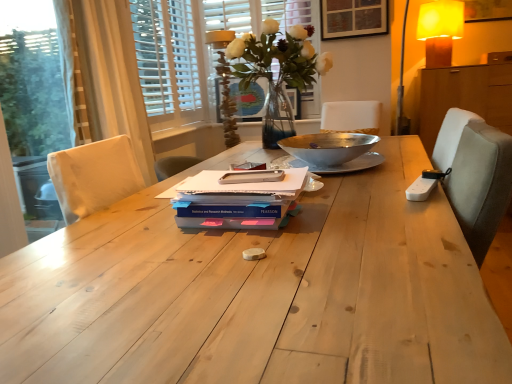
Question: Which direction should I rotate to look at clear glass vase at upper center, placed as the 2th bay window when sorted from left to right, — up or down?

Choices:
 (A) down
 (B) up

Answer: (B)

Question: Is blue matte paperback book at center, the third paperback book viewed from the top, inside clear glass vase at upper center, the 1th bay window viewed from the right?

Choices:
 (A) no
 (B) yes

Answer: (A)

Question: Considering the relative sizes of clear glass vase at upper center, the 1th bay window viewed from the right, and blue matte paperback book at center, the third paperback book viewed from the top, in the image provided, is clear glass vase at upper center, the 1th bay window viewed from the right, bigger than blue matte paperback book at center, the third paperback book viewed from the top,?

Choices:
 (A) yes
 (B) no

Answer: (A)

Question: Is clear glass vase at upper center, placed as the 2th bay window when sorted from left to right, looking in the opposite direction of blue matte paperback book at center, the third paperback book viewed from the top?

Choices:
 (A) yes
 (B) no

Answer: (B)

Question: Is clear glass vase at upper center, the 1th bay window viewed from the right, located outside blue matte paperback book at center, which appears as the first paperback book when ordered from the bottom?

Choices:
 (A) no
 (B) yes

Answer: (B)

Question: Does clear glass vase at upper center, the 1th bay window viewed from the right, appear on the right side of blue matte paperback book at center, which appears as the first paperback book when ordered from the bottom?

Choices:
 (A) yes
 (B) no

Answer: (A)

Question: Does clear glass vase at upper center, the 1th bay window viewed from the right, have a smaller size compared to blue matte paperback book at center, the third paperback book viewed from the top?

Choices:
 (A) yes
 (B) no

Answer: (B)

Question: From the image's perspective, would you say matte glass vase at upper center, arranged as the 2th table lamp when viewed from the right, is shown under translucent glass vase at center?

Choices:
 (A) no
 (B) yes

Answer: (A)

Question: From a real-world perspective, is matte glass vase at upper center, positioned as the 1th table lamp in bottom-to-top order, positioned under translucent glass vase at center based on gravity?

Choices:
 (A) yes
 (B) no

Answer: (A)

Question: Considering the relative sizes of matte glass vase at upper center, arranged as the 2th table lamp when viewed from the right, and translucent glass vase at center in the image provided, is matte glass vase at upper center, arranged as the 2th table lamp when viewed from the right, smaller than translucent glass vase at center?

Choices:
 (A) no
 (B) yes

Answer: (B)

Question: Does matte glass vase at upper center, arranged as the first table lamp when viewed from the left, have a greater height compared to translucent glass vase at center?

Choices:
 (A) yes
 (B) no

Answer: (A)

Question: Does matte glass vase at upper center, arranged as the first table lamp when viewed from the left, appear on the right side of translucent glass vase at center?

Choices:
 (A) no
 (B) yes

Answer: (A)

Question: Does matte glass vase at upper center, the first table lamp from the front, come in front of translucent glass vase at center?

Choices:
 (A) no
 (B) yes

Answer: (A)

Question: From a real-world perspective, is white wooden blinds at upper left, which is the 2th bay window in right-to-left order, located beneath white matte notebook at center, positioned as the 1th paperback book in top-to-bottom order?

Choices:
 (A) no
 (B) yes

Answer: (A)